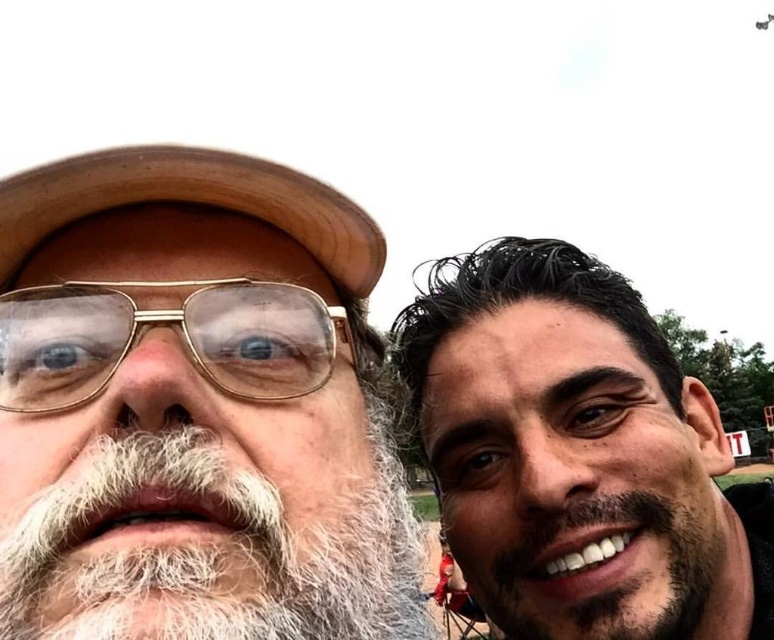
Question: Which point appears farthest from the camera in this image?

Choices:
 (A) (629, 541)
 (B) (677, 440)
 (C) (279, 209)
 (D) (305, 310)

Answer: (B)

Question: Which of these objects is positioned farthest from the white beard at left?

Choices:
 (A) dark brown stubble at right
 (B) brown leather baseball hat at upper left

Answer: (A)

Question: Is white beard at left positioned at the back of brown leather baseball hat at upper left?

Choices:
 (A) no
 (B) yes

Answer: (A)

Question: Estimate the real-world distances between objects in this image. Which object is farther from the gold-framed glasses at center?

Choices:
 (A) dark brown stubble at right
 (B) white fuzzy beard at left
 (C) smooth skin face at upper right

Answer: (A)

Question: Does white fuzzy beard at left have a larger size compared to dark brown stubble at right?

Choices:
 (A) yes
 (B) no

Answer: (A)

Question: Can you confirm if white beard at left is positioned above smooth skin face at upper right?

Choices:
 (A) no
 (B) yes

Answer: (A)